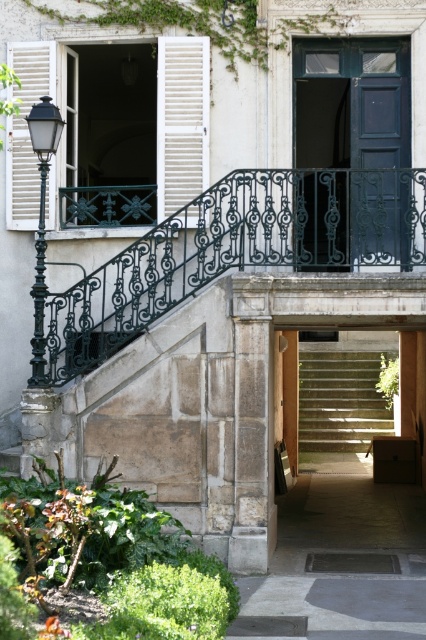
Question: Among these objects, which one is farthest from the camera?

Choices:
 (A) black wrought iron streetlamp at left
 (B) dark blue wood door at center
 (C) light gray concrete stairs at center

Answer: (C)

Question: Which object is closer to the camera taking this photo?

Choices:
 (A) white wooden shutter at left
 (B) light gray concrete stairs at center
 (C) dark blue wood door at center

Answer: (C)

Question: Observing the image, what is the correct spatial positioning of black wrought iron balustrade at center in reference to black wrought iron streetlamp at left?

Choices:
 (A) below
 (B) above

Answer: (A)

Question: Can you confirm if black wrought iron balustrade at center is smaller than white wooden shutters at upper left?

Choices:
 (A) yes
 (B) no

Answer: (B)

Question: Observing the image, what is the correct spatial positioning of light gray concrete stairs at center in reference to white wooden shutters at upper left?

Choices:
 (A) left
 (B) right

Answer: (B)

Question: Which of the following is the farthest from the observer?

Choices:
 (A) (383, 131)
 (B) (31, 221)
 (C) (92, 288)
 (D) (333, 384)

Answer: (D)